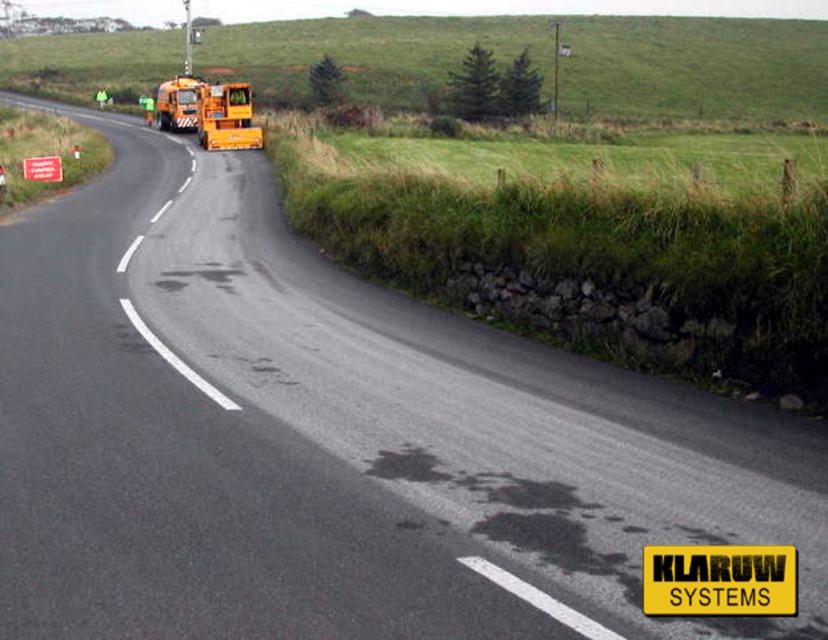
Who is positioned more to the right, yellow metallic school bus at upper left or orange metallic truck at upper left?

yellow metallic school bus at upper left is more to the right.

Can you confirm if yellow metallic school bus at upper left is shorter than orange metallic truck at upper left?

In fact, yellow metallic school bus at upper left may be taller than orange metallic truck at upper left.

Identify the location of yellow metallic school bus at upper left. (225, 116).